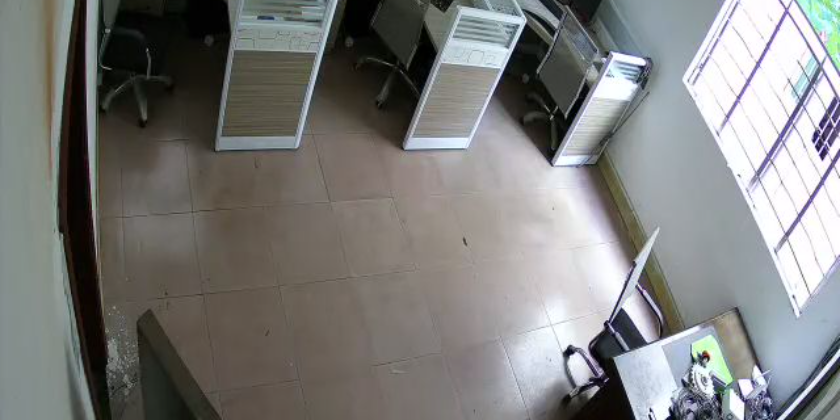
Image resolution: width=840 pixels, height=420 pixels. What are the coordinates of `chair` in the screenshot? It's located at (147, 65), (384, 74), (558, 94), (631, 313).